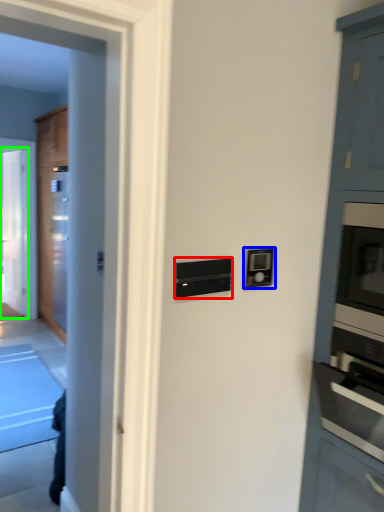
Question: Considering the real-world distances, which object is closest to appliance (highlighted by a red box)? light switch (highlighted by a blue box) or glass door (highlighted by a green box).

Choices:
 (A) light switch
 (B) glass door

Answer: (A)